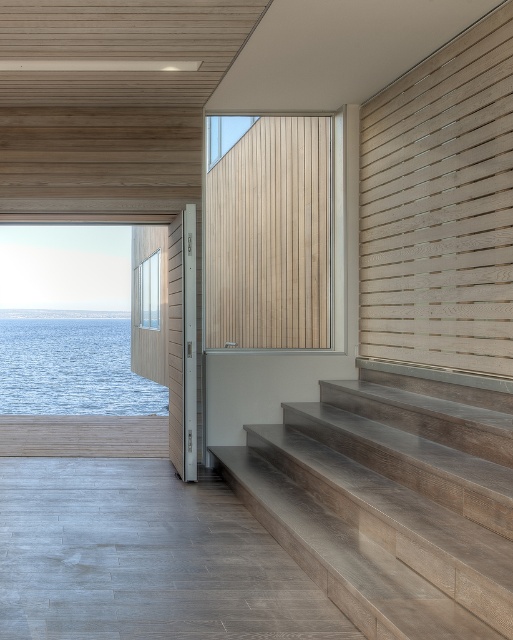
Question: Is the position of wooden textured stairs at lower right less distant than that of blue water at left?

Choices:
 (A) yes
 (B) no

Answer: (A)

Question: Which of the following is the farthest from the observer?

Choices:
 (A) (438, 385)
 (B) (125, 388)

Answer: (B)

Question: Does wooden textured stairs at lower right have a lesser width compared to blue water at left?

Choices:
 (A) yes
 (B) no

Answer: (A)

Question: Can you confirm if wooden textured stairs at lower right is positioned below blue water at left?

Choices:
 (A) yes
 (B) no

Answer: (B)

Question: Which point is farther from the camera taking this photo?

Choices:
 (A) (300, 433)
 (B) (104, 332)

Answer: (B)

Question: Which point is closer to the camera taking this photo?

Choices:
 (A) (114, 403)
 (B) (489, 627)

Answer: (B)